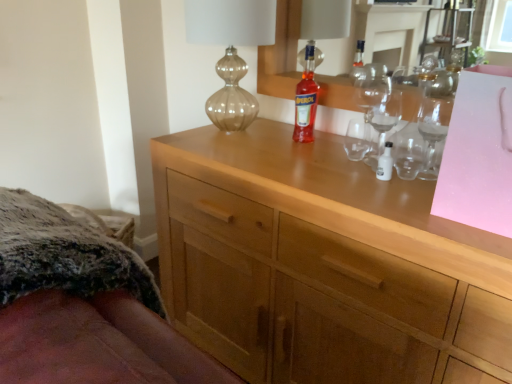
Where is `free location to the left of transparent glass wine glass at upper right`? The width and height of the screenshot is (512, 384). free location to the left of transparent glass wine glass at upper right is located at coordinates (347, 162).